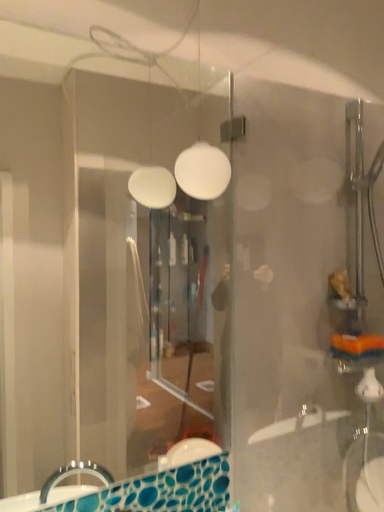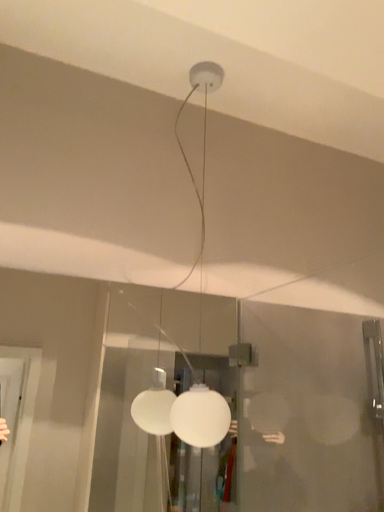
Question: Which way did the camera rotate in the video?

Choices:
 (A) rotated downward
 (B) rotated upward

Answer: (B)